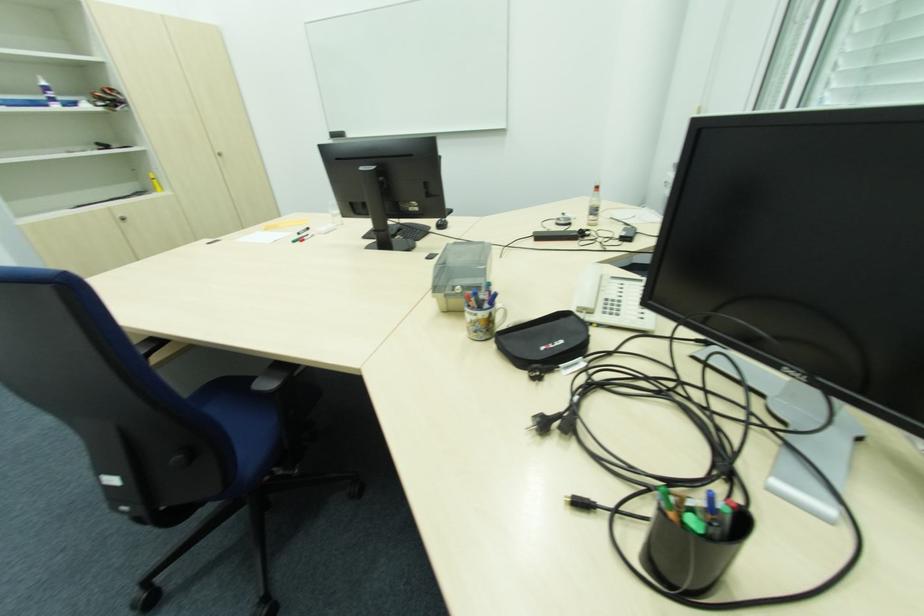
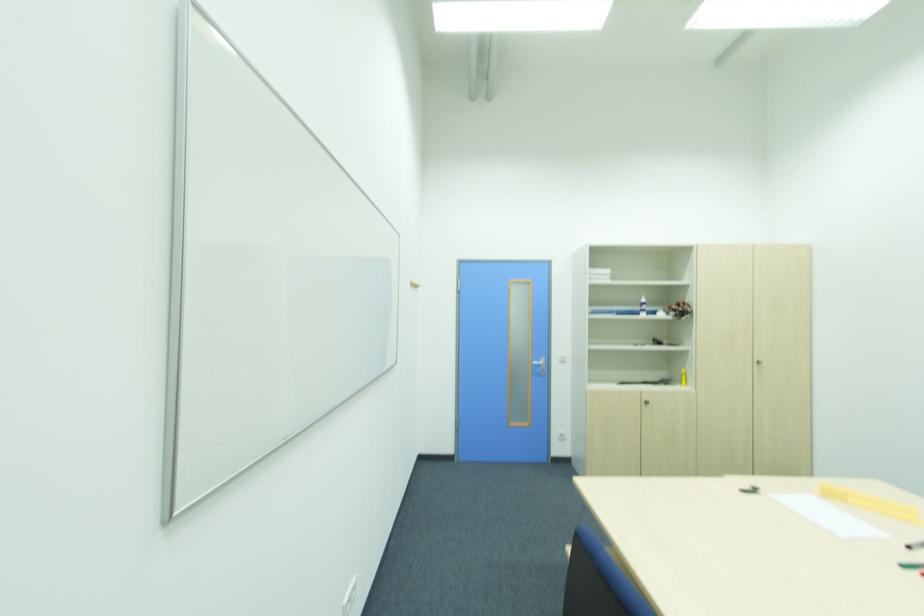
Locate, in the second image, the point that corresponds to (x=41, y=84) in the first image.

(643, 301)